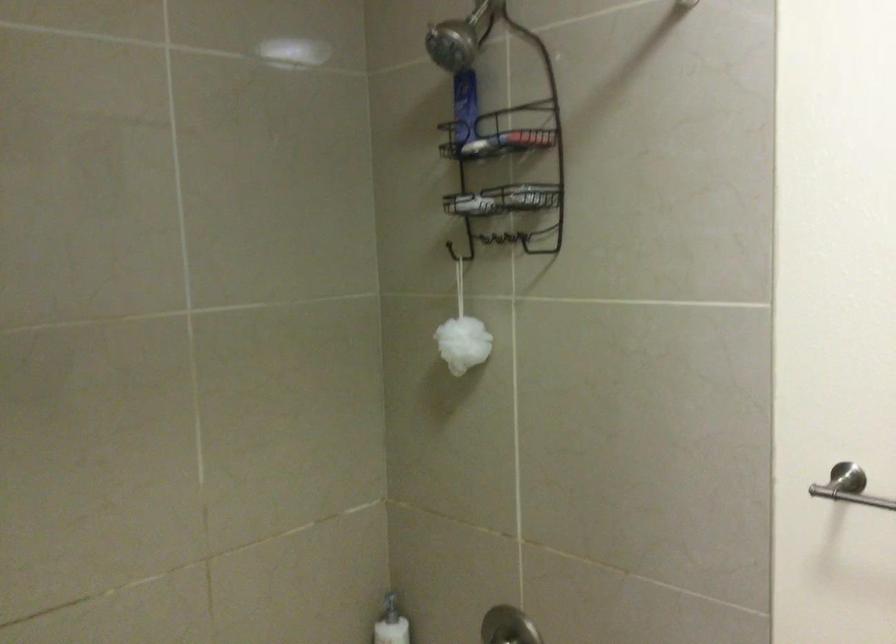
At what (x,y) coordinates should I click in order to perform the action: click on dispenser pump. Please return your answer as a coordinate pair (x, y). This screenshot has width=896, height=644. Looking at the image, I should click on (389, 605).